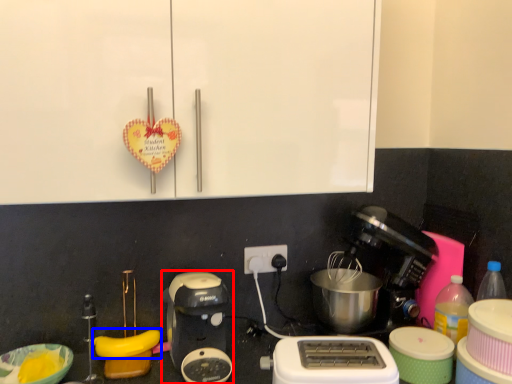
Question: Among these objects, which one is nearest to the camera, coffee maker (highlighted by a red box) or banana (highlighted by a blue box)?

Choices:
 (A) coffee maker
 (B) banana

Answer: (A)